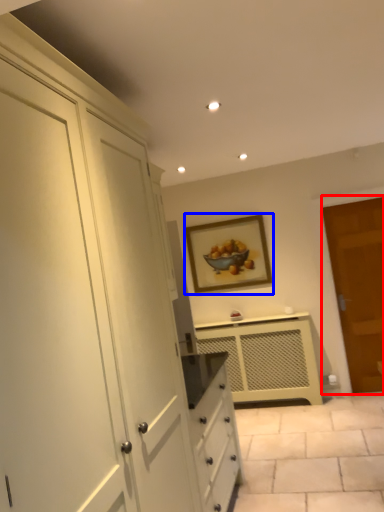
Question: Among these objects, which one is farthest to the camera, door (highlighted by a red box) or picture frame (highlighted by a blue box)?

Choices:
 (A) door
 (B) picture frame

Answer: (B)